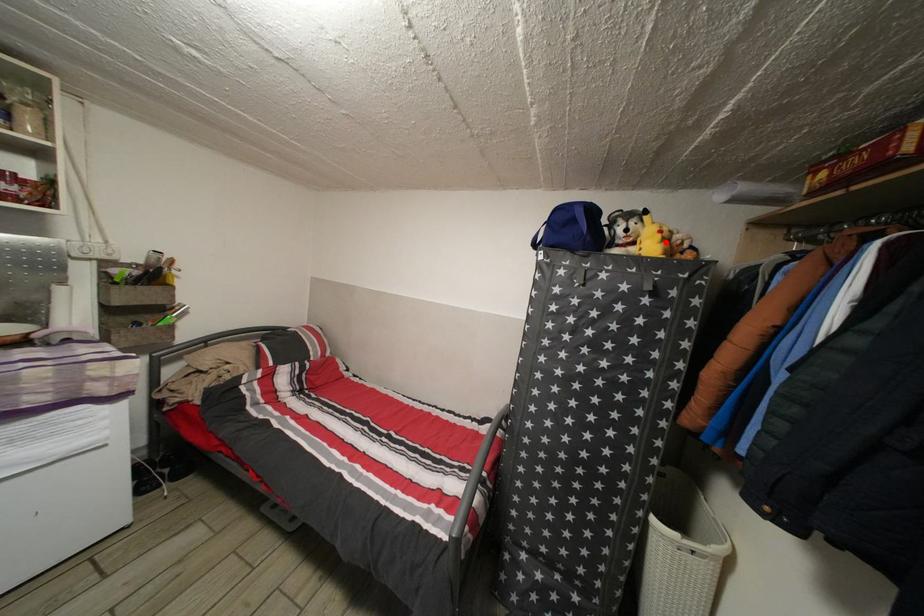
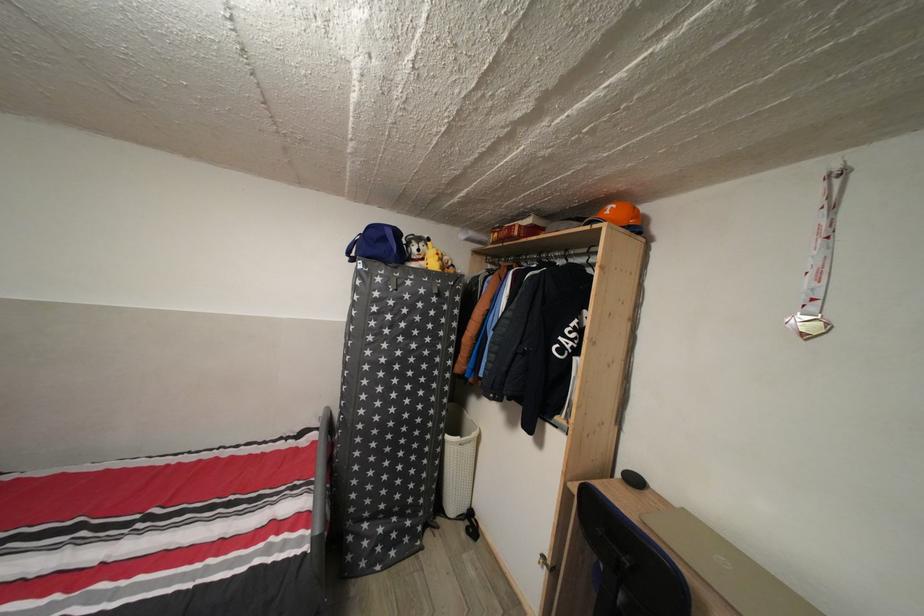
In the second image, find the point that corresponds to the highlighted location in the first image.

(444, 264)